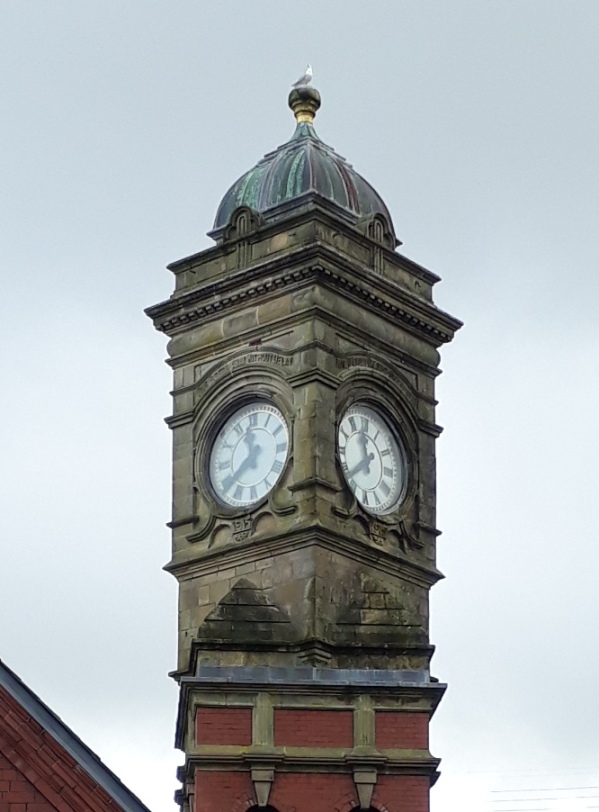
Find the location of a particular element. This screenshot has height=812, width=599. finnial is located at coordinates (302, 97).